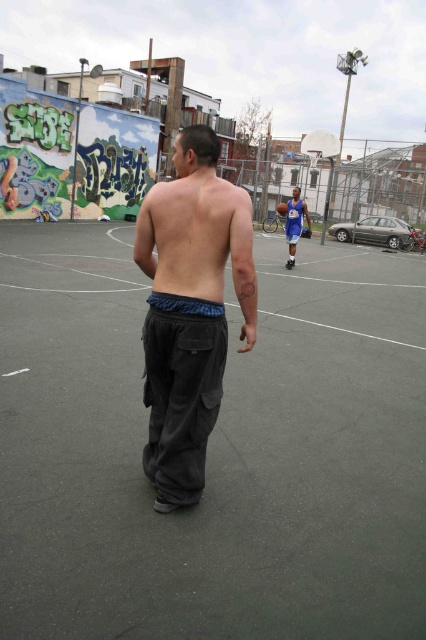
Question: Is dark gray asphalt court at center thinner than blue fabric at lower center?

Choices:
 (A) yes
 (B) no

Answer: (B)

Question: Considering the relative positions of dark gray asphalt court at center and blue fabric at lower center in the image provided, where is dark gray asphalt court at center located with respect to blue fabric at lower center?

Choices:
 (A) left
 (B) right

Answer: (B)

Question: Which object is the closest to the blue fabric at lower center?

Choices:
 (A) blue jersey at center
 (B) dark gray asphalt court at center
 (C) dark gray cargo pants at center
 (D) shiny blue basketball at center

Answer: (C)

Question: Is dark gray cargo pants at center smaller than blue fabric at lower center?

Choices:
 (A) no
 (B) yes

Answer: (A)

Question: Estimate the real-world distances between objects in this image. Which object is closer to the dark gray asphalt court at center?

Choices:
 (A) blue jersey at center
 (B) shiny blue basketball at center
 (C) blue fabric at lower center

Answer: (C)

Question: Which object is closer to the camera taking this photo?

Choices:
 (A) blue jersey at center
 (B) dark gray cargo pants at center
 (C) dark gray asphalt court at center
 (D) blue fabric at lower center

Answer: (C)